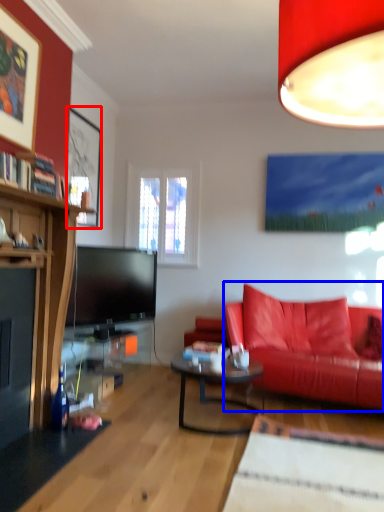
Question: Among these objects, which one is farthest to the camera, picture frame (highlighted by a red box) or studio couch (highlighted by a blue box)?

Choices:
 (A) picture frame
 (B) studio couch

Answer: (A)